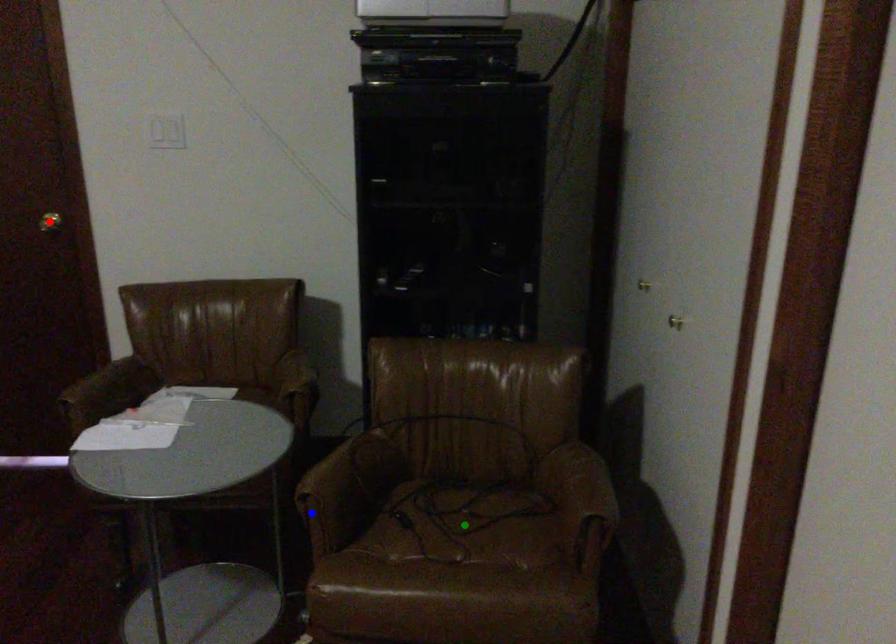
Order these from farthest to nearest:
A) blue point
B) red point
C) green point

1. red point
2. green point
3. blue point